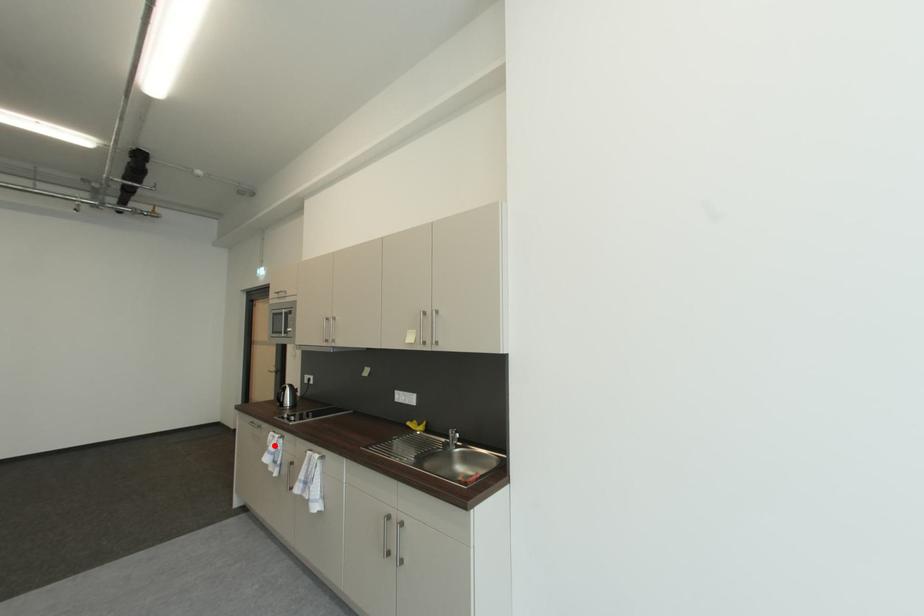
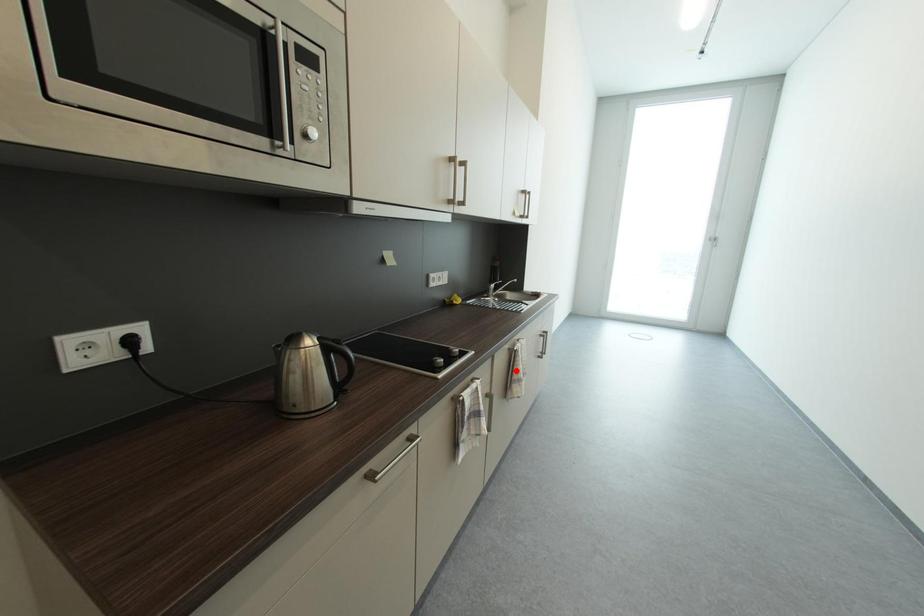
I am providing you with two images of the same scene from different viewpoints. A red point is marked on the first image and another point is marked on the second image. Are the points marked in image1 and image2 representing the same 3D position?

No